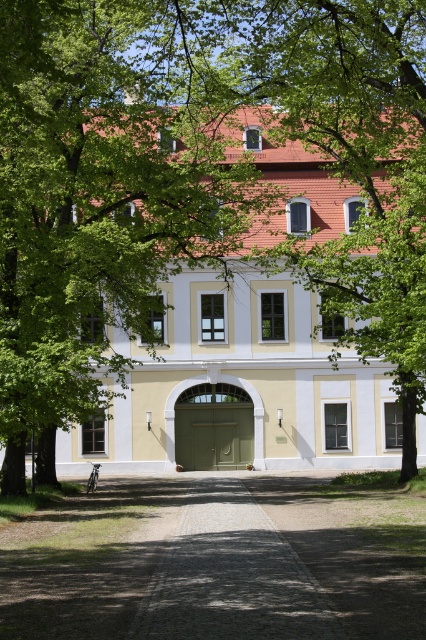
Question: Which point is closer to the camera?

Choices:
 (A) green matte/glossy door at center
 (B) gray cobblestone driveway at center

Answer: (B)

Question: Is gray cobblestone driveway at center bigger than green matte/glossy door at center?

Choices:
 (A) yes
 (B) no

Answer: (A)

Question: Does gray cobblestone driveway at center come in front of green matte/glossy door at center?

Choices:
 (A) yes
 (B) no

Answer: (A)

Question: Is gray cobblestone driveway at center to the left of green matte/glossy door at center from the viewer's perspective?

Choices:
 (A) no
 (B) yes

Answer: (A)

Question: Among these points, which one is farthest from the camera?

Choices:
 (A) (215, 442)
 (B) (396, 500)

Answer: (A)